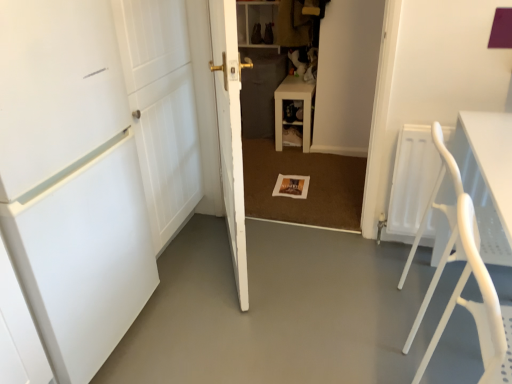
Identify the location of vacant area situated below white matte door at center, the 1th door from the right (from a real-world perspective). (232, 262).